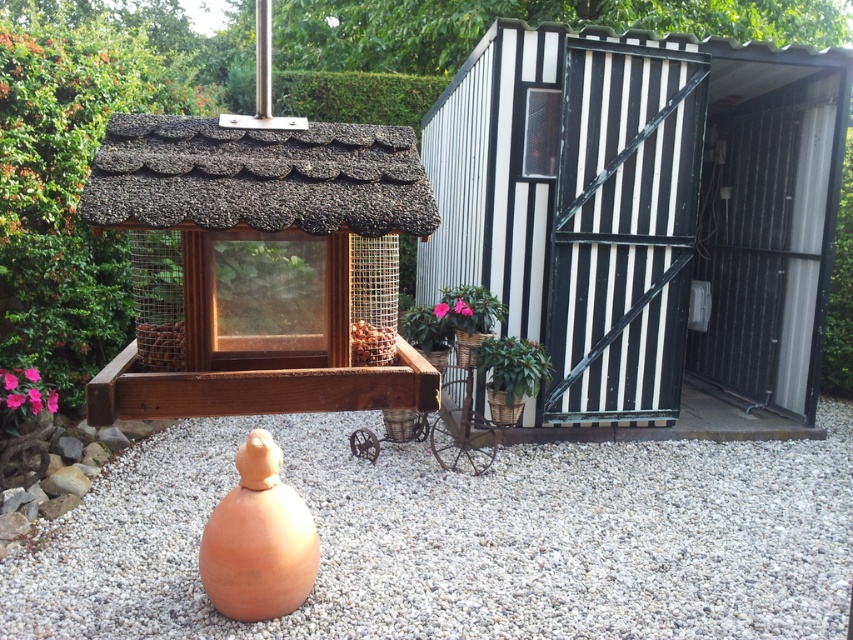
You are planning to place a new decorative stone path in the garden. The path must be wider than the existing wooden bird feeder at center. Can the white gravel at center be used for this purpose?

The white gravel at center has a width that surpasses the wooden bird feeder at center, so yes, it can be used to create a path wider than the wooden bird feeder at center.

You are a gardener who wants to place a new decorative item between the wooden bird feeder at center and the green leafy plant at right. Based on their positions, where should you place the item to ensure it is between them?

The wooden bird feeder at center is to the left of the green leafy plant at right, so placing the new decorative item between them would require positioning it to the right of the wooden bird feeder at center and to the left of the green leafy plant at right.